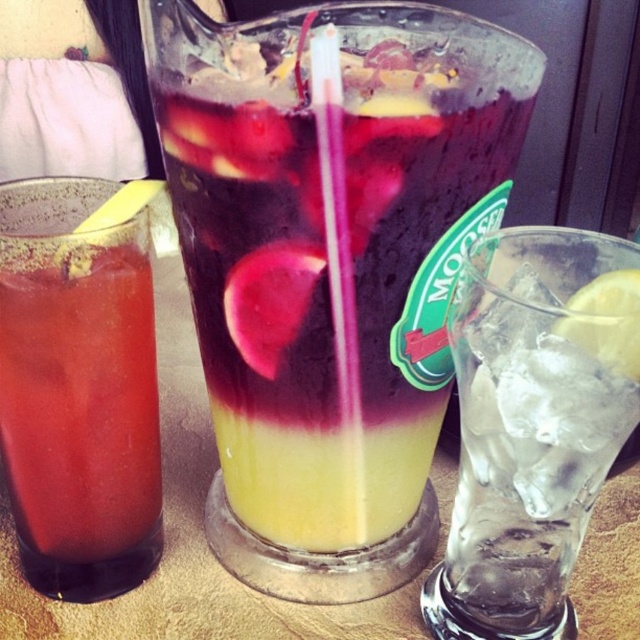
Question: Can you confirm if clear glass ice at center is positioned above translucent glass at left?

Choices:
 (A) yes
 (B) no

Answer: (B)

Question: Considering the real-world distances, which object is farthest from the yellow matte lemon at right?

Choices:
 (A) translucent glass at left
 (B) translucent glass at center
 (C) transparent plastic straw at center

Answer: (A)

Question: Estimate the real-world distances between objects in this image. Which object is closer to the translucent glass at left?

Choices:
 (A) translucent glass at center
 (B) clear glass ice at center

Answer: (A)

Question: Does clear glass ice at center have a smaller size compared to translucent glass at left?

Choices:
 (A) no
 (B) yes

Answer: (A)

Question: Which of the following is the closest to the observer?

Choices:
 (A) (342, 449)
 (B) (584, 372)

Answer: (B)

Question: Does clear glass ice at center appear over yellow matte lemon at right?

Choices:
 (A) no
 (B) yes

Answer: (A)